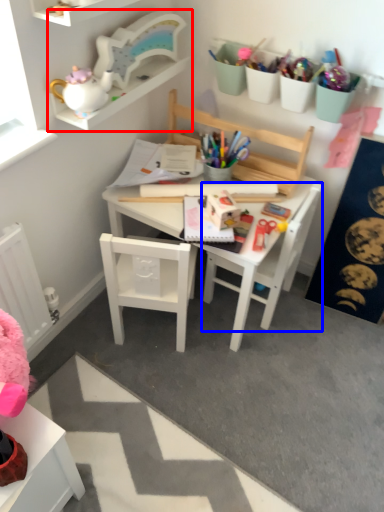
Question: Which object appears closest to the camera in this image, shelf (highlighted by a red box) or chair (highlighted by a blue box)?

Choices:
 (A) shelf
 (B) chair

Answer: (A)